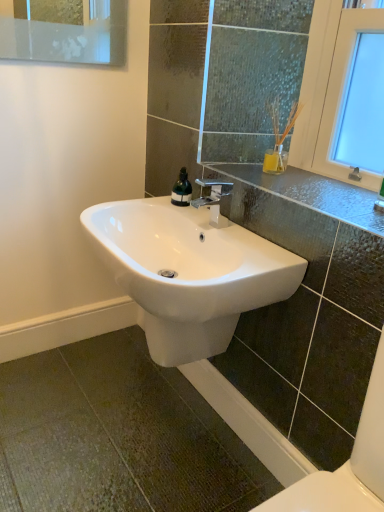
Locate an element on the screen. vacant space in front of polished chrome faucet at center is located at coordinates (241, 246).